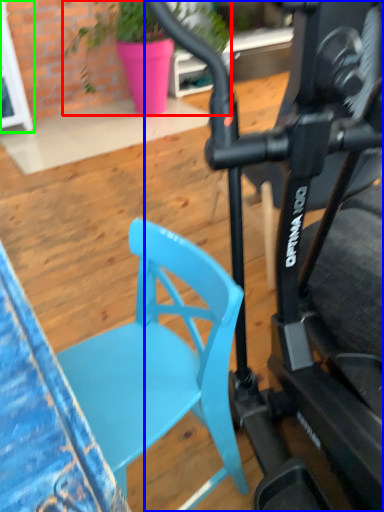
Question: Which object is the farthest from houseplant (highlighted by a red box)? Choose among these: bicycle (highlighted by a blue box) or glass door (highlighted by a green box).

Choices:
 (A) bicycle
 (B) glass door

Answer: (A)